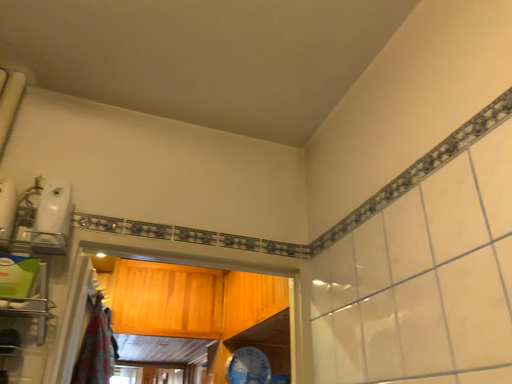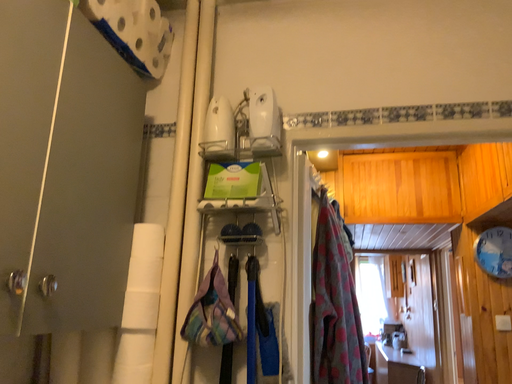
Question: How did the camera likely rotate when shooting the video?

Choices:
 (A) rotated downward
 (B) rotated upward

Answer: (A)